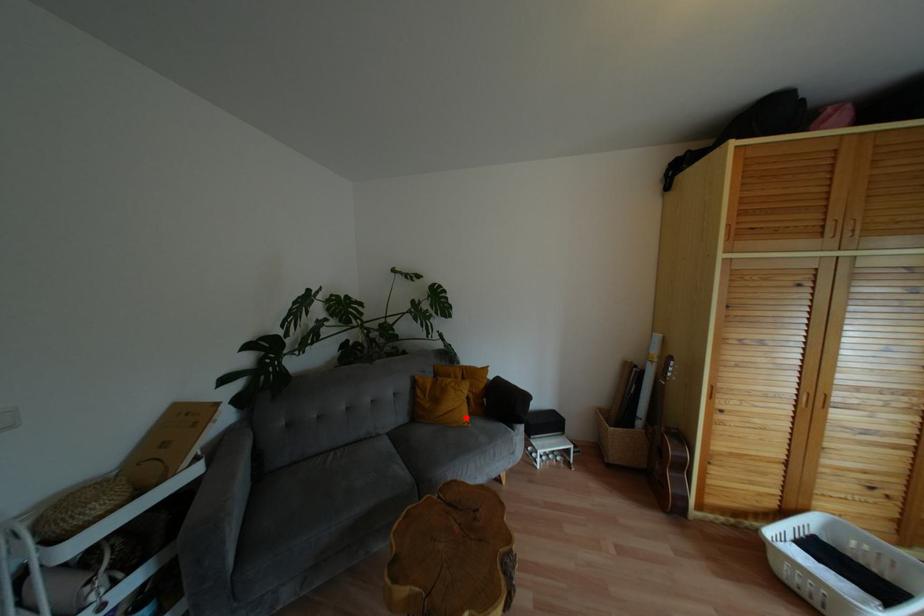
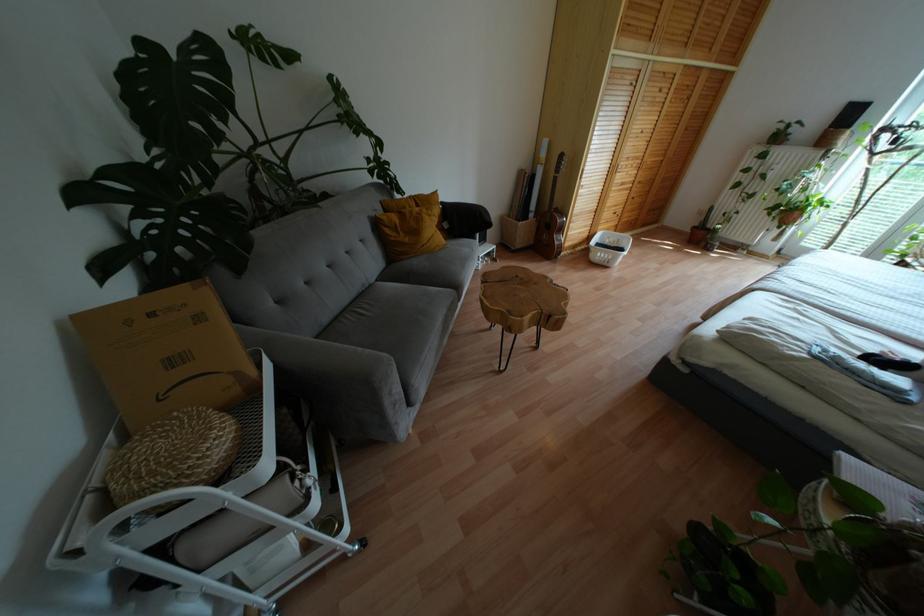
Locate, in the second image, the point that corresponds to the highlighted location in the first image.

(443, 240)